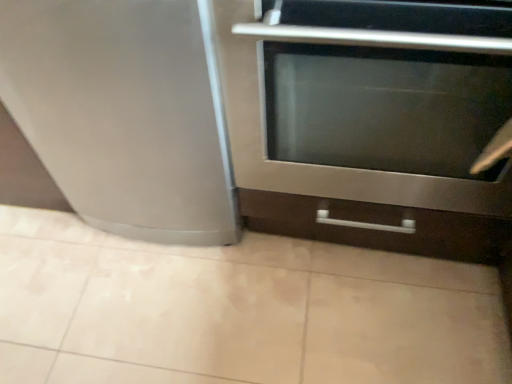
Question: From the image's perspective, is satin silver refrigerator at left on top of stainless steel oven at center?

Choices:
 (A) no
 (B) yes

Answer: (B)

Question: Is satin silver refrigerator at left smaller than stainless steel oven at center?

Choices:
 (A) yes
 (B) no

Answer: (A)

Question: Can you confirm if satin silver refrigerator at left is thinner than stainless steel oven at center?

Choices:
 (A) no
 (B) yes

Answer: (A)

Question: Is satin silver refrigerator at left bigger than stainless steel oven at center?

Choices:
 (A) no
 (B) yes

Answer: (A)

Question: Could you tell me if satin silver refrigerator at left is turned towards stainless steel oven at center?

Choices:
 (A) no
 (B) yes

Answer: (A)

Question: Based on their sizes in the image, would you say beige ceramic tile at lower center is bigger or smaller than stainless steel oven at center?

Choices:
 (A) big
 (B) small

Answer: (B)

Question: Is beige ceramic tile at lower center wider or thinner than stainless steel oven at center?

Choices:
 (A) thin
 (B) wide

Answer: (B)

Question: From the image's perspective, is beige ceramic tile at lower center positioned above or below stainless steel oven at center?

Choices:
 (A) above
 (B) below

Answer: (B)

Question: Does point (148, 307) appear closer or farther from the camera than point (336, 49)?

Choices:
 (A) farther
 (B) closer

Answer: (A)

Question: Based on their sizes in the image, would you say beige ceramic tile at lower center is bigger or smaller than satin silver refrigerator at left?

Choices:
 (A) small
 (B) big

Answer: (A)

Question: Considering the positions of point (143, 321) and point (123, 225), is point (143, 321) closer or farther from the camera than point (123, 225)?

Choices:
 (A) closer
 (B) farther

Answer: (A)

Question: In terms of width, does beige ceramic tile at lower center look wider or thinner when compared to satin silver refrigerator at left?

Choices:
 (A) thin
 (B) wide

Answer: (B)

Question: From the image's perspective, is beige ceramic tile at lower center above or below satin silver refrigerator at left?

Choices:
 (A) below
 (B) above

Answer: (A)

Question: Is stainless steel oven at center in front of or behind beige ceramic tile at lower center in the image?

Choices:
 (A) front
 (B) behind

Answer: (A)

Question: In terms of height, does stainless steel oven at center look taller or shorter compared to beige ceramic tile at lower center?

Choices:
 (A) tall
 (B) short

Answer: (A)